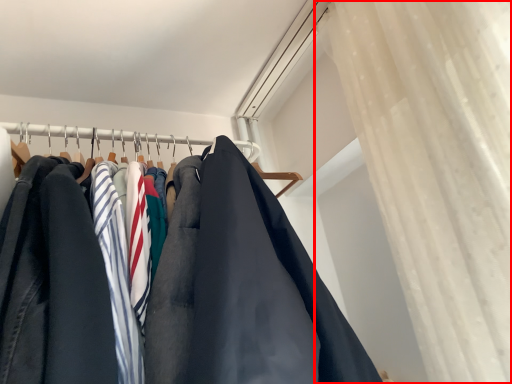
Question: Where is curtain (annotated by the red box) located in relation to closet in the image?

Choices:
 (A) right
 (B) left

Answer: (A)